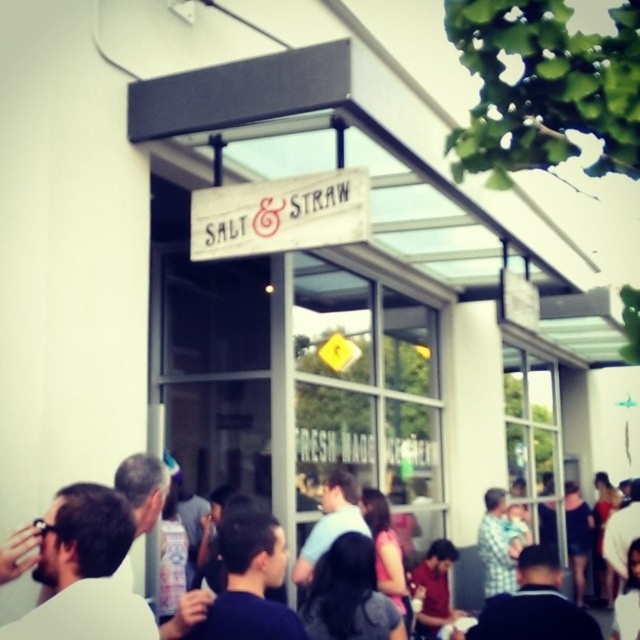
Who is taller, white wood sign at center or dark blue shirt at center?

Standing taller between the two is white wood sign at center.

Is white wood sign at center to the left of dark blue shirt at center from the viewer's perspective?

No, white wood sign at center is not to the left of dark blue shirt at center.

Does point (330, 232) lie in front of point (4, 582)?

No, (330, 232) is further to viewer.

The image size is (640, 640). Identify the location of white wood sign at center. (280, 214).